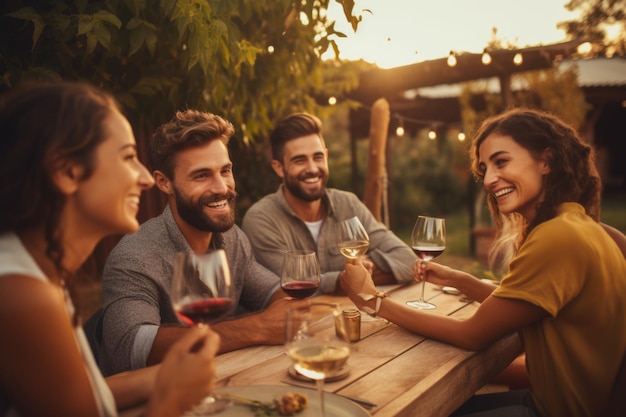
In order to click on glass in this screenshot , I will do `click(202, 281)`, `click(320, 336)`, `click(305, 269)`, `click(352, 240)`, `click(424, 236)`.